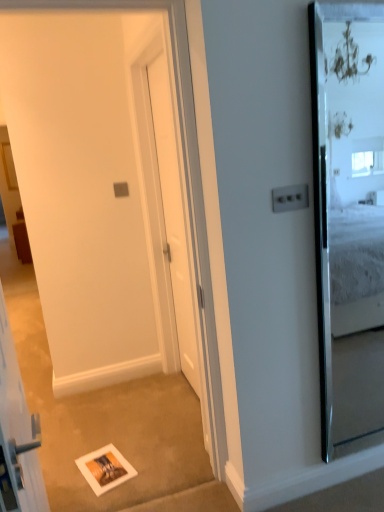
I want to click on free space behind white matte barn door at center, so click(141, 441).